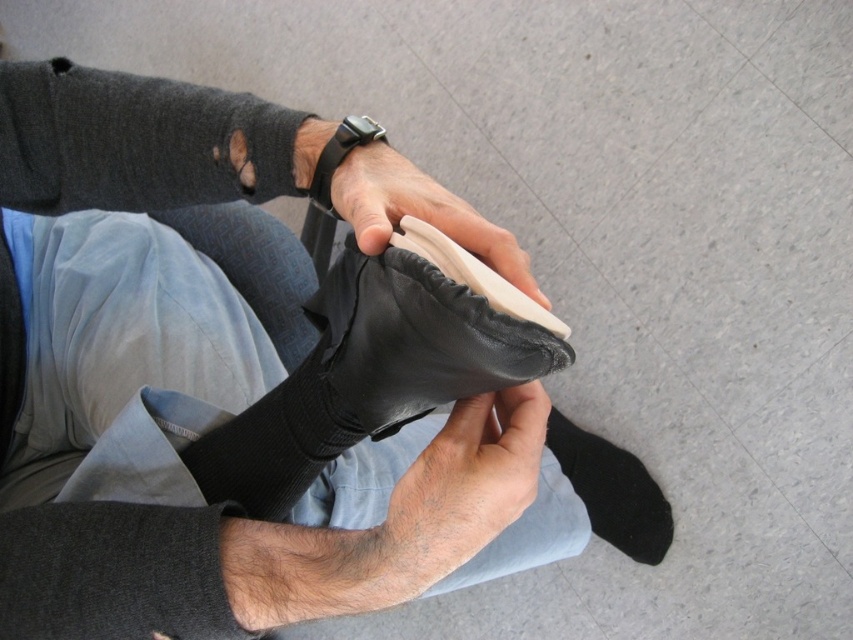
Does smooth skin at center appear on the right side of leather shoe at center?

Yes, smooth skin at center is to the right of leather shoe at center.

Is smooth skin at center smaller than leather shoe at center?

Correct, smooth skin at center occupies less space than leather shoe at center.

The width and height of the screenshot is (853, 640). Find the location of `smooth skin at center`. smooth skin at center is located at coordinates (463, 486).

I want to click on smooth skin at center, so click(x=463, y=486).

Who is lower down, black leather shoe at center or black suede sock at lower right?

black suede sock at lower right is lower down.

Between point (479, 320) and point (666, 518), which one is positioned behind?

Point (666, 518)

Does point (517, 364) lie behind point (631, 520)?

That is False.

Where is `black leather shoe at center`? The height and width of the screenshot is (640, 853). black leather shoe at center is located at coordinates (425, 330).

Which is more to the right, smooth skin at center or black suede sock at lower right?

Positioned to the right is black suede sock at lower right.

Can you confirm if smooth skin at center is taller than black suede sock at lower right?

In fact, smooth skin at center may be shorter than black suede sock at lower right.

This screenshot has width=853, height=640. What are the coordinates of `smooth skin at center` in the screenshot? It's located at (463, 486).